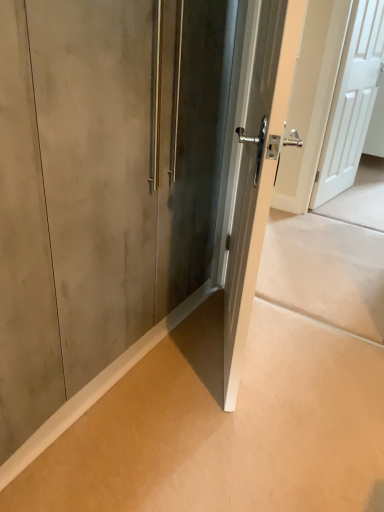
In order to click on vacant area that lies in front of satin silver door at center, the 2th door positioned from the back in this screenshot , I will do `click(226, 430)`.